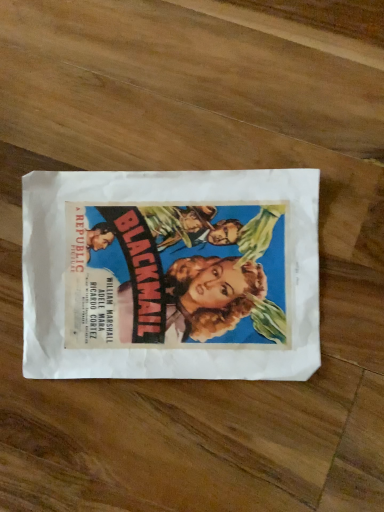
Image resolution: width=384 pixels, height=512 pixels. Describe the element at coordinates (171, 275) in the screenshot. I see `vintage paper poster at center` at that location.

Find the location of a particular element. The width and height of the screenshot is (384, 512). vintage paper poster at center is located at coordinates 171,275.

The width and height of the screenshot is (384, 512). I want to click on vintage paper poster at center, so click(x=171, y=275).